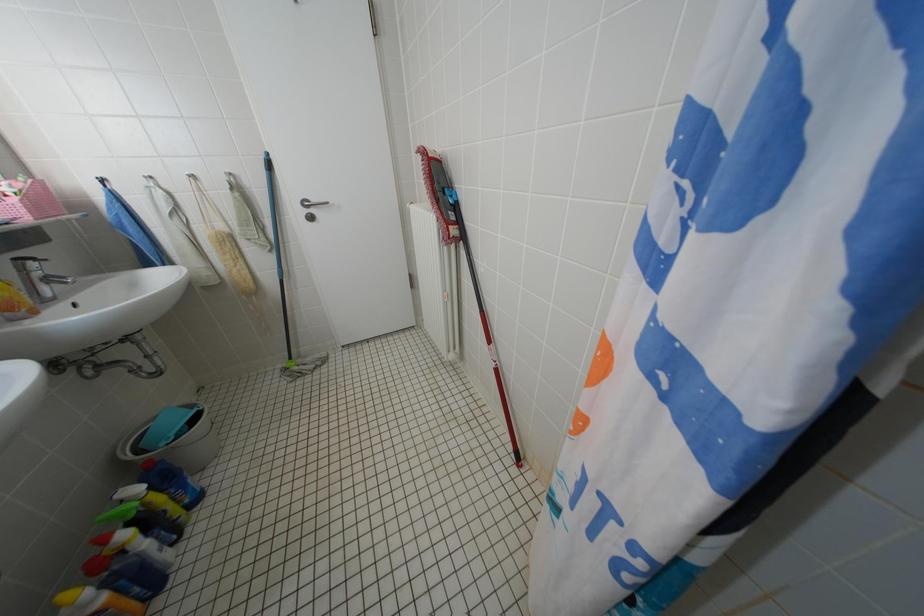
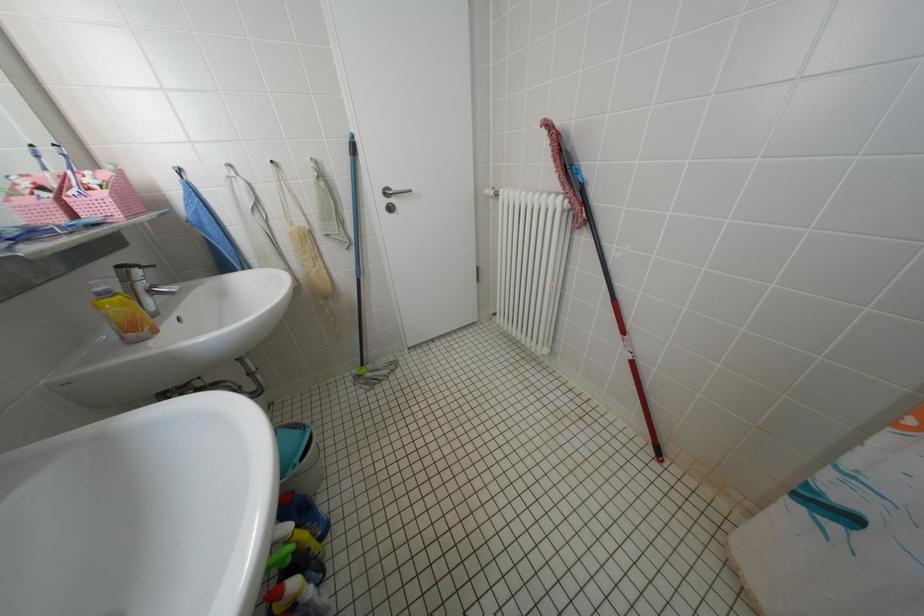
Question: The camera is either moving clockwise (left) or counter-clockwise (right) around the object. The first image is from the beginning of the video and the second image is from the end. Is the camera moving left or right when shooting the video?

Choices:
 (A) Left
 (B) Right

Answer: (A)